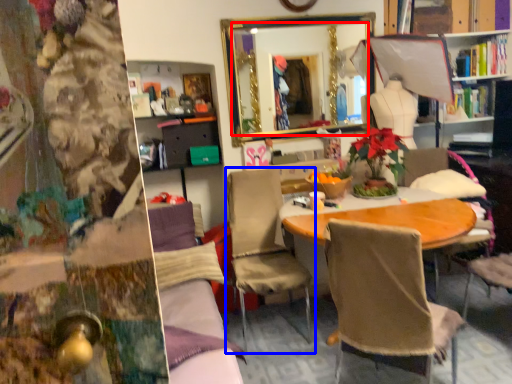
Question: Which object is closer to the camera taking this photo, mirror (highlighted by a red box) or chair (highlighted by a blue box)?

Choices:
 (A) mirror
 (B) chair

Answer: (B)